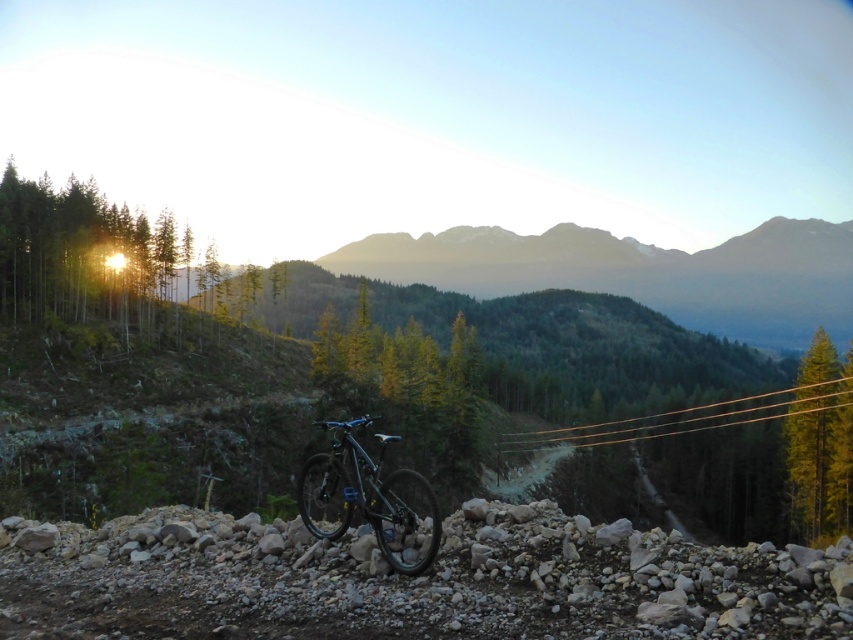
Question: Which point is farther to the camera?

Choices:
 (A) smooth dirt trail at center
 (B) grayish-brown rocky mountain at center

Answer: (B)

Question: In this image, where is grayish-brown rocky mountain at center located relative to smooth dirt trail at center?

Choices:
 (A) below
 (B) above

Answer: (B)

Question: Can you confirm if grayish-brown rocky mountain at center is thinner than green matte tree at right?

Choices:
 (A) no
 (B) yes

Answer: (A)

Question: Can you confirm if grayish-brown rocky mountain at center is positioned to the left of smooth dirt trail at center?

Choices:
 (A) no
 (B) yes

Answer: (A)

Question: Which of the following is the farthest from the observer?

Choices:
 (A) grayish-brown rocky mountain at center
 (B) smooth dirt trail at center
 (C) shiny blue frame at center

Answer: (A)

Question: Which object appears closest to the camera in this image?

Choices:
 (A) smooth dirt trail at center
 (B) grayish-brown rocky mountain at center
 (C) green matte tree at right

Answer: (C)